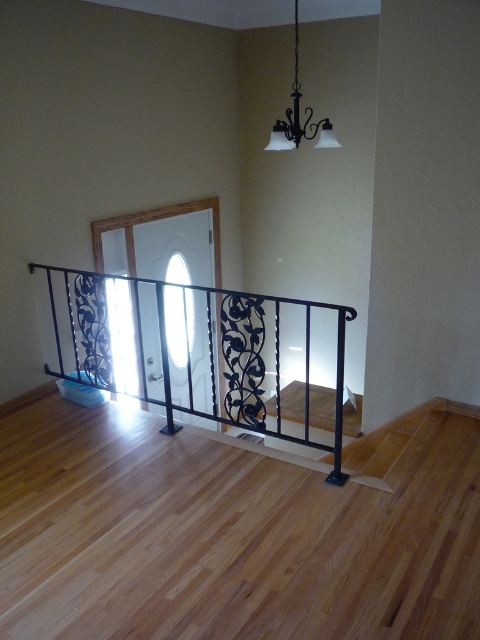
Does black wrought iron railing at center have a larger size compared to black matte chandelier at upper center?

Correct, black wrought iron railing at center is larger in size than black matte chandelier at upper center.

Is point (255, 412) more distant than point (305, 108)?

No, (255, 412) is closer to viewer.

I want to click on black wrought iron railing at center, so click(x=189, y=349).

I want to click on black wrought iron railing at center, so click(189, 349).